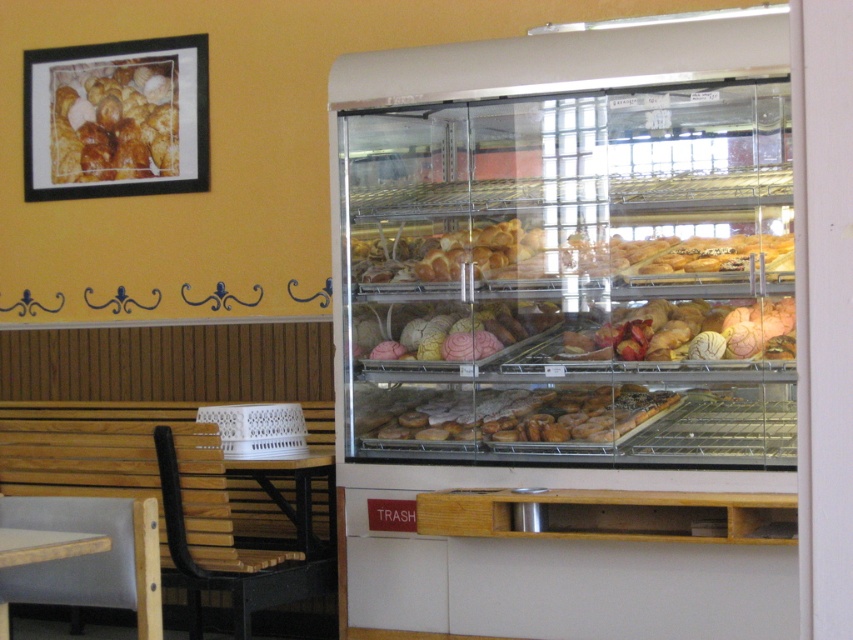
Question: Is glazed doughnuts at center to the right of golden brown pastry at center from the viewer's perspective?

Choices:
 (A) yes
 (B) no

Answer: (B)

Question: Which point is farther from the camera taking this photo?

Choices:
 (A) (248, 604)
 (B) (173, 106)
 (C) (589, 406)
 (D) (703, 237)

Answer: (B)

Question: Is matte white donuts at center positioned behind wooden table at lower left?

Choices:
 (A) no
 (B) yes

Answer: (B)

Question: Is black wood chair at lower left smaller than wooden table at lower left?

Choices:
 (A) yes
 (B) no

Answer: (B)

Question: Which point is farther to the camera?

Choices:
 (A) (354, 340)
 (B) (404, 262)
 (C) (503, 413)

Answer: (B)

Question: Which point appears closest to the camera in this image?

Choices:
 (A) (367, 257)
 (B) (22, 531)
 (C) (643, 317)
 (D) (563, 438)

Answer: (B)